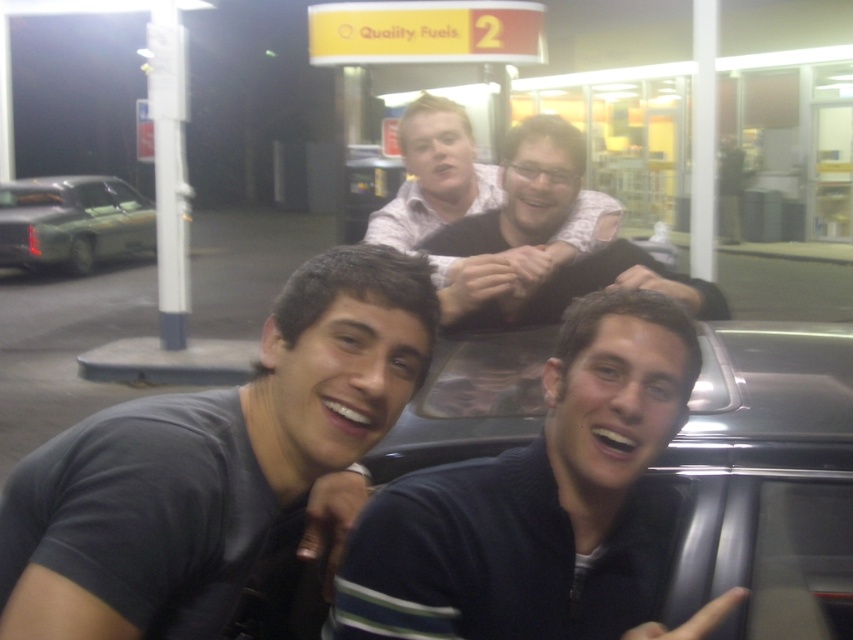
Does dark blue sweater at center have a lesser width compared to green matte car at left?

Yes.

Does point (560, 365) lie behind point (117, 179)?

No, it is not.

Describe the element at coordinates (540, 502) in the screenshot. I see `dark blue sweater at center` at that location.

Find the location of a particular element. This screenshot has height=640, width=853. dark blue sweater at center is located at coordinates (540, 502).

Who is higher up, matte black shirt at upper center or green matte car at left?

Positioned higher is green matte car at left.

Can you confirm if matte black shirt at upper center is positioned to the right of green matte car at left?

Correct, you'll find matte black shirt at upper center to the right of green matte car at left.

The height and width of the screenshot is (640, 853). In order to click on matte black shirt at upper center in this screenshot , I will do `click(434, 176)`.

Does dark gray t-shirt at center appear on the left side of dark blue sweater at center?

Yes, dark gray t-shirt at center is to the left of dark blue sweater at center.

Is dark gray t-shirt at center positioned before dark blue sweater at center?

That is True.

Where is `dark gray t-shirt at center`? dark gray t-shirt at center is located at coordinates (212, 460).

Where is `dark gray t-shirt at center`? Image resolution: width=853 pixels, height=640 pixels. dark gray t-shirt at center is located at coordinates (212, 460).